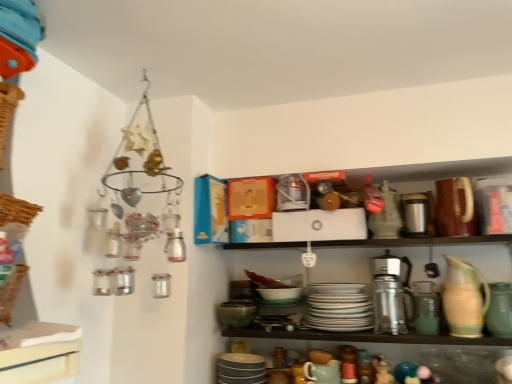
Question: Relative to white glossy plates at center, the third tableware positioned from the left, is metallic silver thermos at lower right in front or behind?

Choices:
 (A) behind
 (B) front

Answer: (B)

Question: Would you say metallic silver thermos at lower right is inside or outside white glossy plates at center, which is counted as the 3th tableware, starting from the right?

Choices:
 (A) inside
 (B) outside

Answer: (B)

Question: Estimate the real-world distances between objects in this image. Which object is farther from the metallic silver thermos at lower right?

Choices:
 (A) speckled ceramic pitcher at right, which is the fourth tableware from left to right
 (B) white glossy plates at center, which is counted as the 3th tableware, starting from the right
 (C) woven brown basket at left
 (D) matte gray plates at lower center, the 5th tableware from the right
 (E) green matte vase at right, which is the 1th tableware in right-to-left order

Answer: (C)

Question: Considering the real-world distances, which object is farthest from the metallic silver thermos at lower right?

Choices:
 (A) woven brown basket at left
 (B) matte ceramic mug at lower center, the fourth tableware when ordered from right to left
 (C) white glossy plates at center, which is counted as the 3th tableware, starting from the right
 (D) green matte vase at right, which is the 1th tableware in right-to-left order
 (E) speckled ceramic pitcher at right, which is the fourth tableware from left to right

Answer: (A)